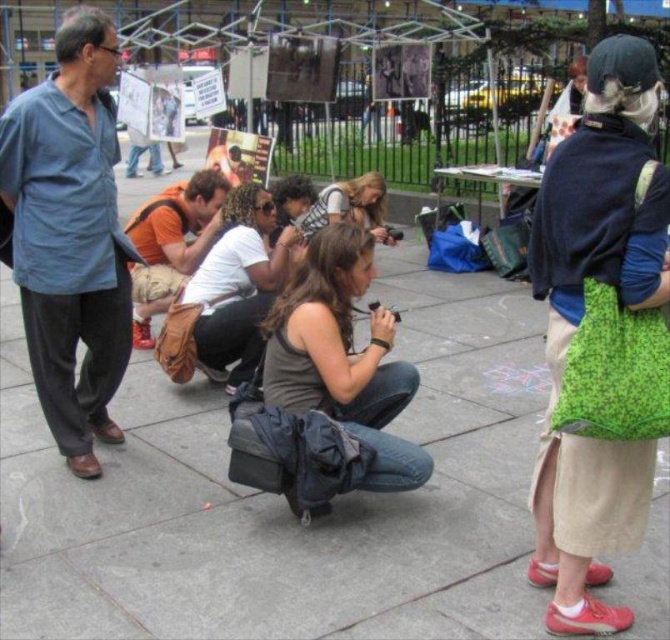
You are a photographer at the event and want to ensure both the orange fabric shirt at center and the matte brown hair at center are clearly visible in your photo. Considering their sizes, which object should you focus on first to ensure it is in frame?

The orange fabric shirt at center has a greater height compared to the matte brown hair at center, so you should focus on the orange fabric shirt at center first to ensure it is in frame since it is larger and more prominent.

Consider the image. You are a photographer standing at the edge of the scene. You want to capture a shot that includes both the concrete sidewalk at center and the matte brown hair at center. Based on their positions, which object should you position closer to the left side of your camera frame?

The concrete sidewalk at center is to the left of matte brown hair at center, so to include both in the frame, position the concrete sidewalk at center closer to the left side and the matte brown hair at center to the right side.